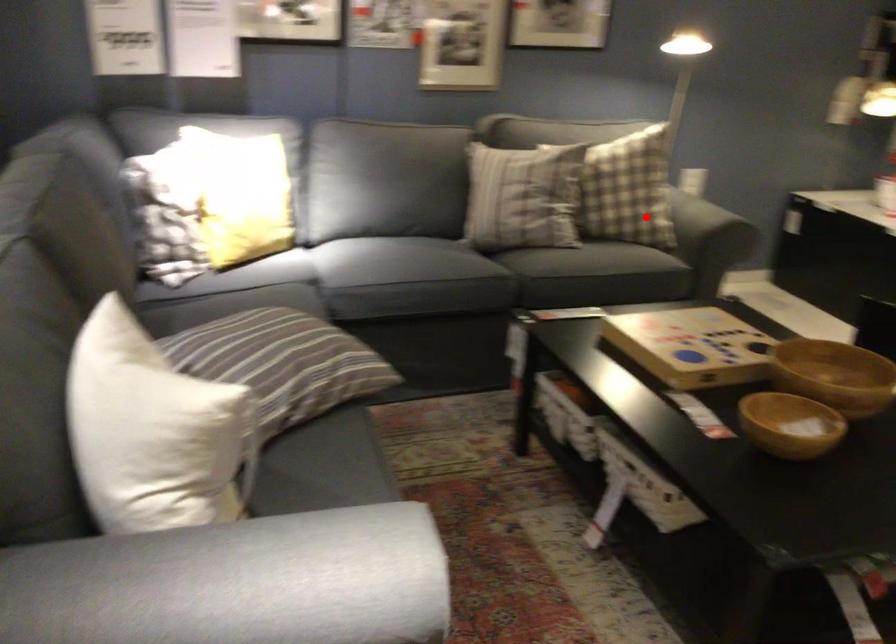
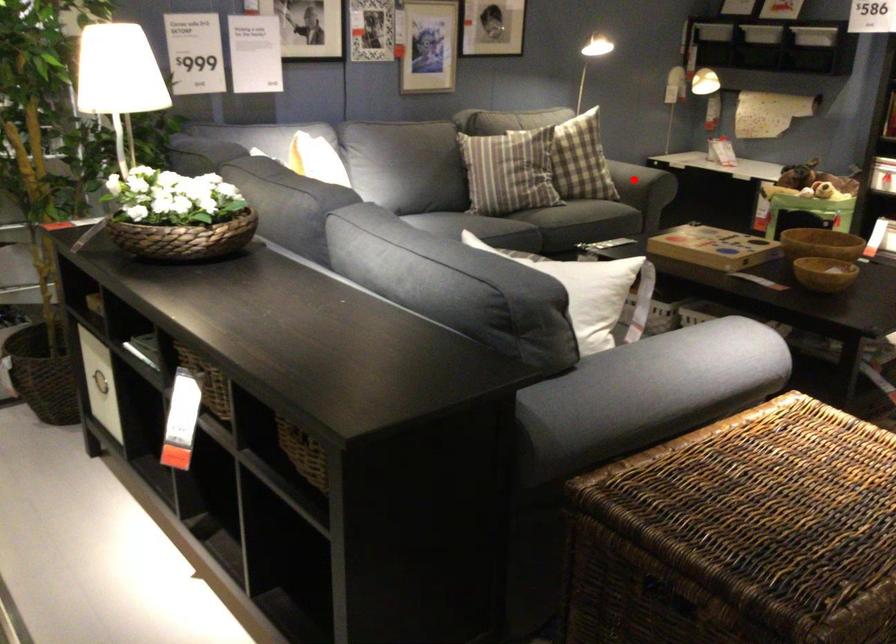
I am providing you with two images of the same scene from different viewpoints. A red point is marked on the first image and another point is marked on the second image. Is the marked point in image1 the same physical position as the marked point in image2?

Yes